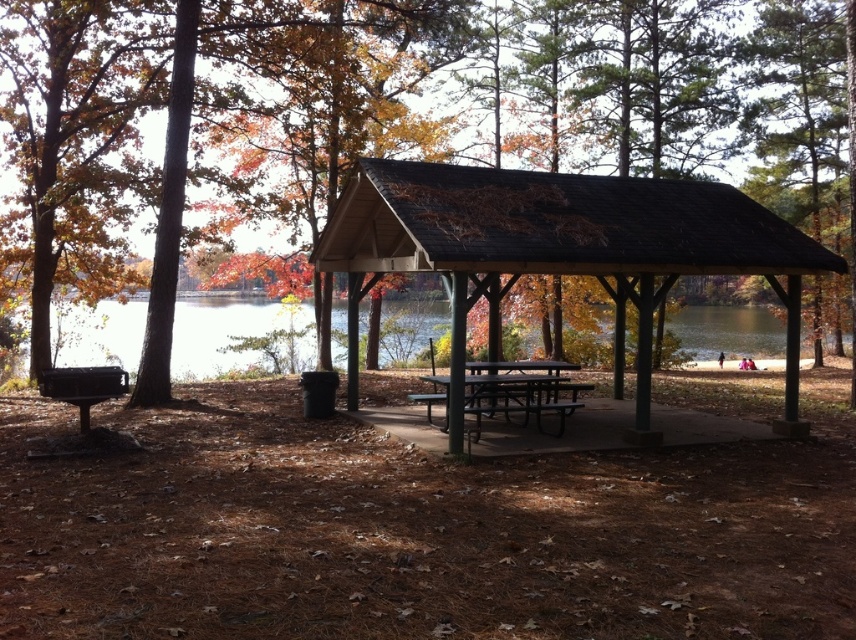
Locate an element on the screen. This screenshot has width=856, height=640. brown wood tree at center is located at coordinates (x=473, y=220).

Does point (393, 205) come farther from viewer compared to point (681, 339)?

That is False.

Locate an element on the screen. This screenshot has height=640, width=856. brown wood tree at center is located at coordinates (473, 220).

Between brown wood gazebo at center and brown wood tree at center, which one has less height?

brown wood gazebo at center is shorter.

Which is in front, point (486, 284) or point (411, 205)?

Point (411, 205) is more forward.

Which is behind, point (794, 228) or point (111, 3)?

The point (111, 3) is more distant.

Identify the location of brown wood gazebo at center. The height and width of the screenshot is (640, 856). (559, 250).

Between point (198, 342) and point (438, 392), which one is positioned in front?

Point (438, 392) is in front.

Does clear water at center appear under black metal picnic table at center?

No, clear water at center is not below black metal picnic table at center.

Which is behind, point (260, 326) or point (553, 401)?

The point (260, 326) is more distant.

The width and height of the screenshot is (856, 640). Identify the location of clear water at center. (218, 332).